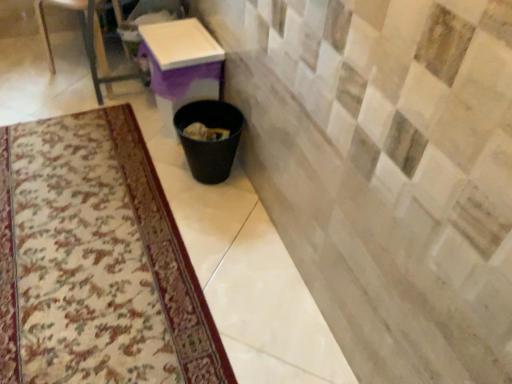
Locate an element on the screen. This screenshot has height=384, width=512. free space in front of white glossy table at center is located at coordinates (149, 160).